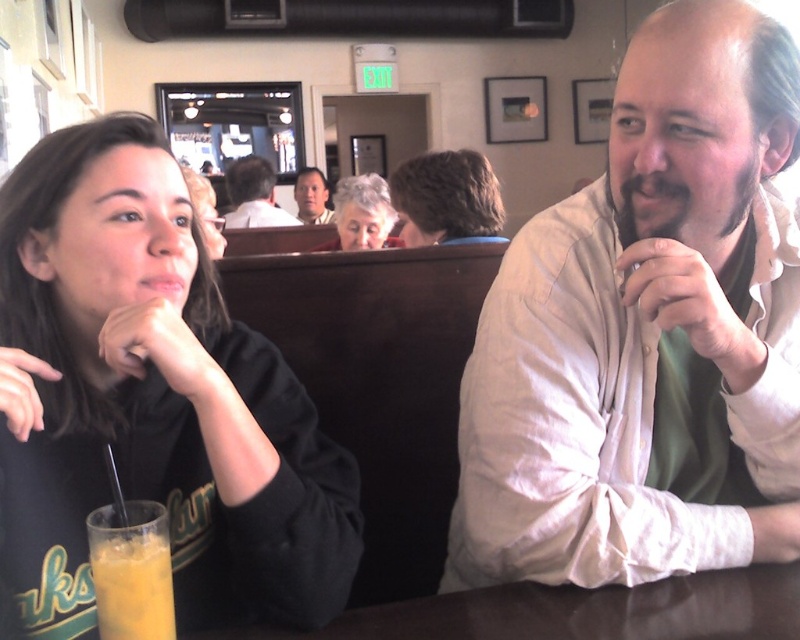
You are a photographer setting up for a group photo. You need to ensure that the black matte shirt at left and the gray hair at center are both in frame. Based on their positions, which object should you focus on first to ensure both are captured?

The black matte shirt at left is positioned on the left side of gray hair at center, so you should focus on the gray hair at center first to ensure both are in frame.

You are a photographer setting up a shoot in this scene. You need to place a small prop between the black matte shirt at left and the gray hair at center. Based on their positions, where should the prop be placed?

The black matte shirt at left is located below the gray hair at center, so the prop should be placed between them in the vertical space above the black matte shirt at left and below the gray hair at center.